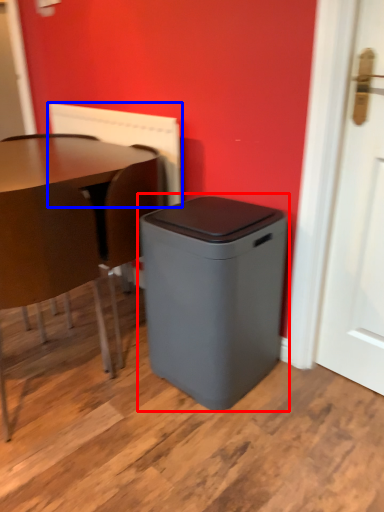
Question: Which object appears farthest to the camera in this image, waste container (highlighted by a red box) or radiator (highlighted by a blue box)?

Choices:
 (A) waste container
 (B) radiator

Answer: (B)